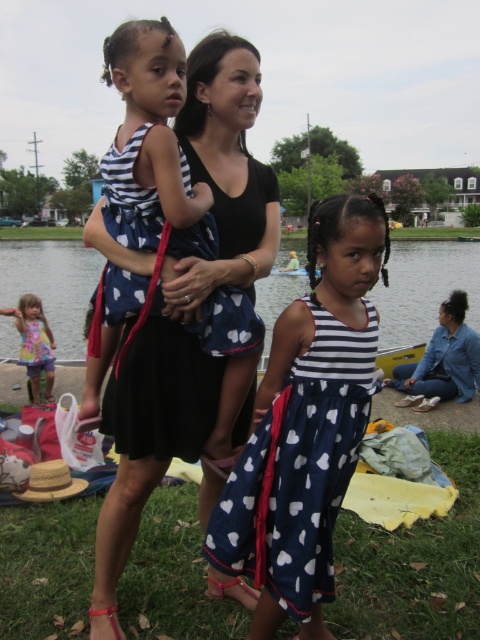
Can you confirm if black matte dress at center is positioned above green grass at lower center?

Correct, black matte dress at center is located above green grass at lower center.

Between black matte dress at center and green grass at lower center, which one has less height?

green grass at lower center

This screenshot has height=640, width=480. In order to click on black matte dress at center in this screenshot , I will do [x=187, y=308].

Who is more forward, (440,612) or (213,368)?

Point (213,368)

Is the position of green grass at lower center less distant than that of blue cotton dress at center?

No.

Locate an element on the screen. green grass at lower center is located at coordinates (414, 563).

Locate an element on the screen. green grass at lower center is located at coordinates (414, 563).

Does black matte dress at center have a lesser height compared to navy blue cotton dress at center?

In fact, black matte dress at center may be taller than navy blue cotton dress at center.

Identify the location of black matte dress at center. The image size is (480, 640). (187, 308).

What are the coordinates of `black matte dress at center` in the screenshot? It's located at (187, 308).

This screenshot has height=640, width=480. Identify the location of black matte dress at center. (187, 308).